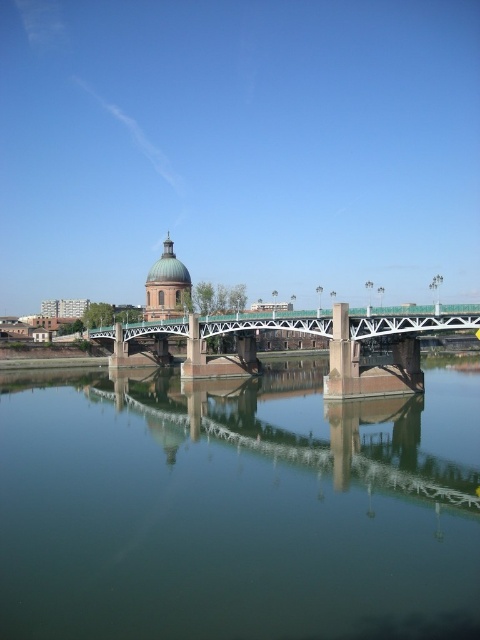
Based on the photo, you are standing on a bridge and want to know how far the green reflective water at center is from you. What is its distance?

The green reflective water at center is 27.05 meters away from the viewer.

You are standing at the point with coordinates point (287, 317) and want to walk towards the bridge. Which direction should you move to reach the bridge first, towards point (456, 403) or away from it?

You should move towards point (456, 403) because it is in front of point (287, 317), meaning it is closer to the bridge.

You are a photographer aiming to capture the green metallic bridge at center and the green reflective water at center in a single frame. Based on their positions, which object should you adjust your camera to focus on first to ensure both are in the shot?

The green reflective water at center is to the left of green metallic bridge at center, so you should focus on the green metallic bridge at center first to ensure both objects are captured in the frame.